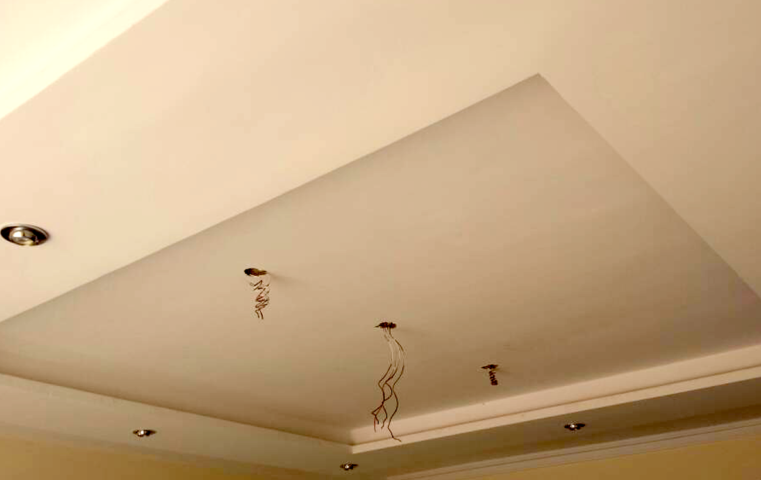
Identify the location of cables hanging from ceiling. (260, 289), (395, 366), (494, 376).